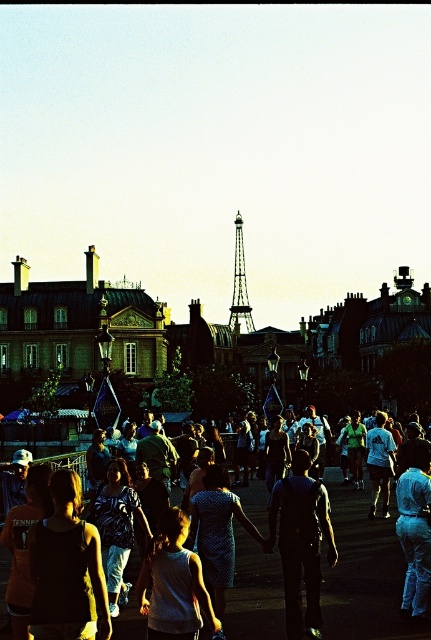
Which of these two, matte blue dress at center or metallic silver eiffel tower at center, stands taller?

metallic silver eiffel tower at center is taller.

Consider the image. Can you confirm if matte blue dress at center is positioned below metallic silver eiffel tower at center?

Correct, matte blue dress at center is located below metallic silver eiffel tower at center.

What do you see at coordinates (362, 570) in the screenshot? I see `matte blue dress at center` at bounding box center [362, 570].

Locate an element on the screen. This screenshot has height=640, width=431. matte blue dress at center is located at coordinates (362, 570).